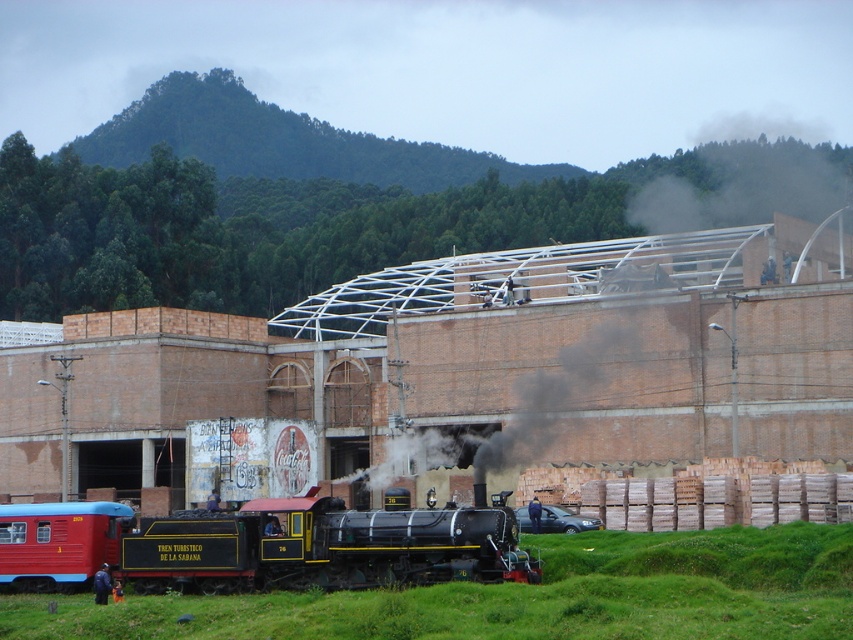
You are a photographer standing at the camera position. You want to capture the black smoke at center in your photo. However, there is a safety guideline stating that you must stay at least 100 meters away from any smoke emissions to avoid inhaling harmful particles. Based on the scene description, can you safely take the photo without violating the guideline?

The black smoke at center is 94.41 meters away from the camera. Since the safety guideline requires staying at least 100 meters away, you are currently too close to safely take the photo without violating the guideline.

You are a photographer trying to capture the black smoke at center and the black polished steam locomotive at center in a single shot. Based on their heights, which one will appear taller in the photo?

The black smoke at center appears taller than the black polished steam locomotive at center in the photo because the description states it has a greater height.

You are a railway engineer assessing the safety of the black polished steam locomotive at center. The safety regulations state that the black smoke at center must be at least 200 feet away from the locomotive to prevent overheating. Is the current distance compliant with the regulations?

The distance between the black smoke at center and the black polished steam locomotive at center is 182.80 feet, which is less than the required 200 feet. Therefore, the current distance does not comply with the safety regulations.